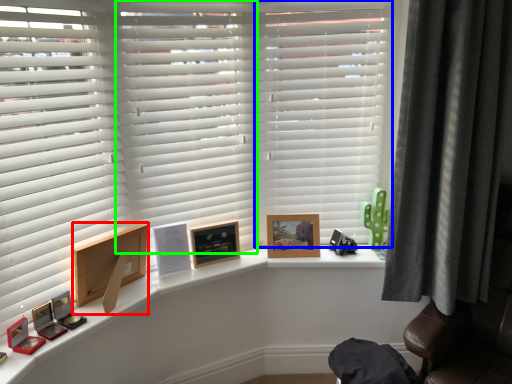
Question: Which object is the farthest from picture frame (highlighted by a red box)? Choose among these: shutter (highlighted by a blue box) or shutter (highlighted by a green box).

Choices:
 (A) shutter
 (B) shutter

Answer: (A)